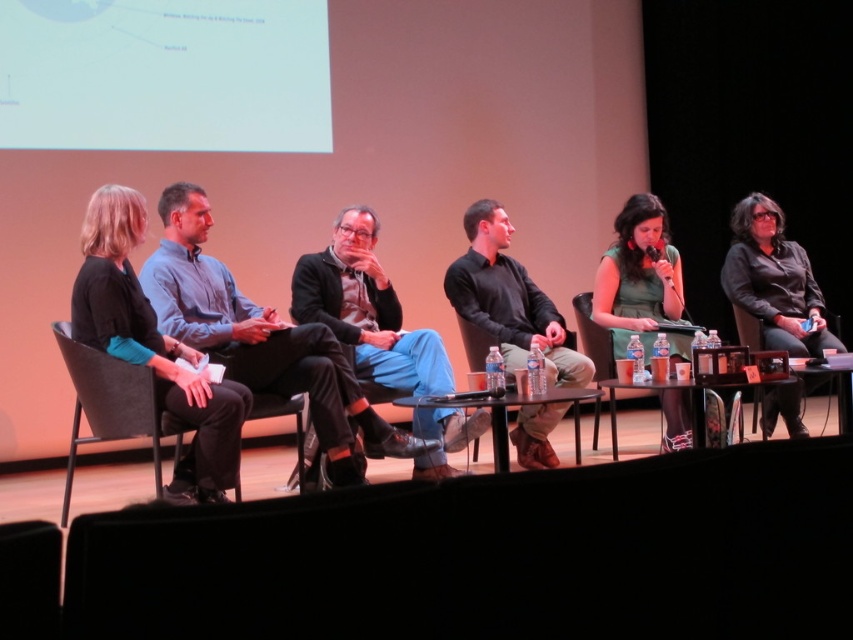
You are organizing a photo shoot and need to ensure that the matte black jacket at center and the black matte shirt at center are both visible in the frame. Given their sizes, which one should you focus on positioning first to ensure both are fully captured?

The matte black jacket at center is bigger than the black matte shirt at center, so you should focus on positioning the matte black jacket at center first to ensure it fits within the frame, allowing space for the smaller black matte shirt at center as well.